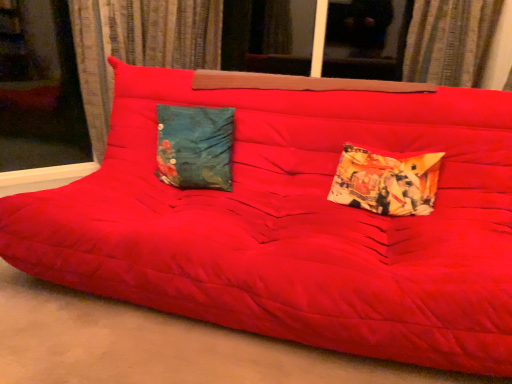
Question: From a real-world perspective, is textured fabric curtain at upper center, the first curtain positioned from the right, located higher than printed fabric pillow at right, positioned as the second pillow in left-to-right order?

Choices:
 (A) no
 (B) yes

Answer: (B)

Question: Does textured fabric curtain at upper center, which appears as the second curtain when viewed from the left, have a greater width compared to printed fabric pillow at right, positioned as the second pillow in left-to-right order?

Choices:
 (A) yes
 (B) no

Answer: (A)

Question: Is textured fabric curtain at upper center, the first curtain positioned from the right, touching printed fabric pillow at right, positioned as the second pillow in left-to-right order?

Choices:
 (A) no
 (B) yes

Answer: (A)

Question: Is textured fabric curtain at upper center, the first curtain positioned from the right, turned away from printed fabric pillow at right, positioned as the second pillow in left-to-right order?

Choices:
 (A) no
 (B) yes

Answer: (A)

Question: Considering the relative positions of textured fabric curtain at upper center, which appears as the second curtain when viewed from the left, and printed fabric pillow at right, positioned as the 1th pillow in right-to-left order, in the image provided, is textured fabric curtain at upper center, which appears as the second curtain when viewed from the left, to the right of printed fabric pillow at right, positioned as the 1th pillow in right-to-left order, from the viewer's perspective?

Choices:
 (A) no
 (B) yes

Answer: (B)

Question: In terms of size, does matte red futon at center appear bigger or smaller than teal fabric pillow at center, acting as the second pillow starting from the right?

Choices:
 (A) big
 (B) small

Answer: (A)

Question: Do you think matte red futon at center is within teal fabric pillow at center, acting as the second pillow starting from the right, or outside of it?

Choices:
 (A) outside
 (B) inside

Answer: (A)

Question: Visually, is matte red futon at center positioned to the left or to the right of teal fabric pillow at center, arranged as the first pillow when viewed from the left?

Choices:
 (A) right
 (B) left

Answer: (B)

Question: Does point (472, 377) appear closer or farther from the camera than point (181, 178)?

Choices:
 (A) farther
 (B) closer

Answer: (B)

Question: Is teal fabric pillow at center, acting as the second pillow starting from the right, taller or shorter than printed fabric pillow at right, positioned as the 1th pillow in right-to-left order?

Choices:
 (A) tall
 (B) short

Answer: (A)

Question: Is teal fabric pillow at center, arranged as the first pillow when viewed from the left, in front of or behind printed fabric pillow at right, positioned as the 1th pillow in right-to-left order, in the image?

Choices:
 (A) behind
 (B) front

Answer: (A)

Question: Is teal fabric pillow at center, arranged as the first pillow when viewed from the left, inside or outside of printed fabric pillow at right, positioned as the second pillow in left-to-right order?

Choices:
 (A) inside
 (B) outside

Answer: (B)

Question: Based on their positions, is teal fabric pillow at center, arranged as the first pillow when viewed from the left, located to the left or right of printed fabric pillow at right, positioned as the second pillow in left-to-right order?

Choices:
 (A) left
 (B) right

Answer: (A)

Question: Considering the relative positions of teal fabric pillow at center, arranged as the first pillow when viewed from the left, and textured fabric curtain at upper center, which appears as the second curtain when viewed from the left, in the image provided, is teal fabric pillow at center, arranged as the first pillow when viewed from the left, to the left or to the right of textured fabric curtain at upper center, which appears as the second curtain when viewed from the left,?

Choices:
 (A) right
 (B) left

Answer: (B)

Question: From a real-world perspective, relative to textured fabric curtain at upper center, which appears as the second curtain when viewed from the left, is teal fabric pillow at center, arranged as the first pillow when viewed from the left, vertically above or below?

Choices:
 (A) above
 (B) below

Answer: (B)